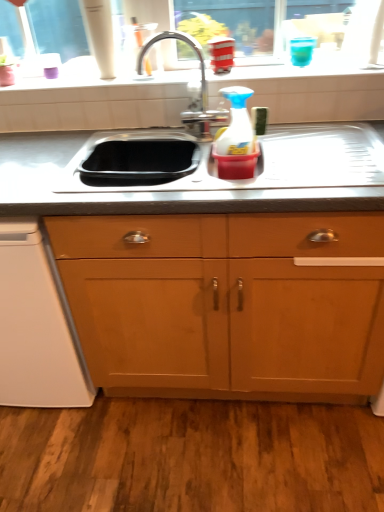
In order to face white glossy window sill at upper center, should I rotate leftwards or rightwards?

It's best to rotate left around 1.848 degrees.

What do you see at coordinates (37, 325) in the screenshot? I see `white plastic dishwasher at lower left` at bounding box center [37, 325].

Identify the location of white plastic dishwasher at lower left. The image size is (384, 512). (37, 325).

What do you see at coordinates (236, 124) in the screenshot? The image size is (384, 512). I see `translucent plastic spray bottle at center` at bounding box center [236, 124].

Measure the distance between point (x=217, y=142) and camera.

Point (x=217, y=142) and camera are 1.27 meters apart from each other.

This screenshot has height=512, width=384. Find the location of `stainless steel sink at center`. stainless steel sink at center is located at coordinates (146, 191).

This screenshot has height=512, width=384. I want to click on polished chrome faucet at center, so click(201, 88).

What is the approximate width of wooden cabinet at center?

24.22 inches.

The image size is (384, 512). Identify the location of white glossy window sill at upper center. (299, 78).

From a real-world perspective, who is located higher, stainless steel sink at center or white glossy window sill at upper center?

In real-world perspective, white glossy window sill at upper center is above.

Is point (272, 211) farther from viewer compared to point (361, 83)?

No, (272, 211) is in front of (361, 83).

Is stainless steel sink at center next to white glossy window sill at upper center and touching it?

No, stainless steel sink at center is not beside white glossy window sill at upper center.

Choose the correct answer: Is wooden cabinet at center inside stainless steel sink at center or outside it?

wooden cabinet at center exists outside the volume of stainless steel sink at center.

The height and width of the screenshot is (512, 384). Find the location of `countertop on the left of wooden cabinet at center`. countertop on the left of wooden cabinet at center is located at coordinates (146, 191).

Looking at this image, which of these two, wooden cabinet at center or stainless steel sink at center, is smaller?

stainless steel sink at center is smaller.

From a real-world perspective, is wooden cabinet at center positioned under stainless steel sink at center based on gravity?

Yes, from a real-world perspective, wooden cabinet at center is below stainless steel sink at center.

Is white glossy window sill at upper center at the back of white plastic dishwasher at lower left?

No, white plastic dishwasher at lower left is not facing away from white glossy window sill at upper center.

In the scene shown: Is white plastic dishwasher at lower left outside of white glossy window sill at upper center?

white plastic dishwasher at lower left lies outside white glossy window sill at upper center's area.

From a real-world perspective, which is physically below, white plastic dishwasher at lower left or white glossy window sill at upper center?

white plastic dishwasher at lower left.

Can you confirm if white plastic dishwasher at lower left is thinner than white glossy window sill at upper center?

In fact, white plastic dishwasher at lower left might be wider than white glossy window sill at upper center.

Are white glossy window sill at upper center and translucent plastic spray bottle at center beside each other?

No, white glossy window sill at upper center is not next to translucent plastic spray bottle at center.

Between point (302, 72) and point (229, 131), which one is positioned in front?

The point (229, 131) is in front.

From the image's perspective, which is above, white glossy window sill at upper center or translucent plastic spray bottle at center?

white glossy window sill at upper center, from the image's perspective.

Is white glossy window sill at upper center turned away from translucent plastic spray bottle at center?

No, white glossy window sill at upper center is not facing the opposite direction of translucent plastic spray bottle at center.

Looking at the image, does white plastic dishwasher at lower left seem bigger or smaller compared to stainless steel sink at center?

white plastic dishwasher at lower left is bigger than stainless steel sink at center.

From a real-world perspective, is white plastic dishwasher at lower left located beneath stainless steel sink at center?

Yes, from a real-world perspective, white plastic dishwasher at lower left is below stainless steel sink at center.

From the image's perspective, does white plastic dishwasher at lower left appear lower than stainless steel sink at center?

Correct, white plastic dishwasher at lower left appears lower than stainless steel sink at center in the image.

Between white plastic dishwasher at lower left and stainless steel sink at center, which one is positioned behind?

white plastic dishwasher at lower left is more distant.

Can you tell me how much polished chrome faucet at center and white plastic dishwasher at lower left differ in facing direction?

There is a 1.32-degree angle between the facing directions of polished chrome faucet at center and white plastic dishwasher at lower left.

Considering the sizes of objects polished chrome faucet at center and white plastic dishwasher at lower left in the image provided, who is thinner, polished chrome faucet at center or white plastic dishwasher at lower left?

polished chrome faucet at center.

Is polished chrome faucet at center located outside white plastic dishwasher at lower left?

Yes, polished chrome faucet at center is outside of white plastic dishwasher at lower left.

Is polished chrome faucet at center at the left side of white plastic dishwasher at lower left?

No.

From the picture: Between translucent plastic spray bottle at center and white glossy window sill at upper center, which one appears on the left side from the viewer's perspective?

white glossy window sill at upper center.

How distant is translucent plastic spray bottle at center from white glossy window sill at upper center?

12.12 inches.

Is translucent plastic spray bottle at center turned away from white glossy window sill at upper center?

Yes, translucent plastic spray bottle at center's orientation is away from white glossy window sill at upper center.

Is translucent plastic spray bottle at center wider than white glossy window sill at upper center?

In fact, translucent plastic spray bottle at center might be narrower than white glossy window sill at upper center.

In order to click on window sill that appears on the left of stainless steel sink at center in this screenshot , I will do `click(299, 78)`.

At what (x,y) coordinates should I click in order to perform the action: click on countertop behind the wooden cabinet at center. Please return your answer as a coordinate pair (x, y). Image resolution: width=384 pixels, height=512 pixels. Looking at the image, I should click on (146, 191).

Based on their spatial positions, is stainless steel sink at center or white plastic dishwasher at lower left closer to white glossy window sill at upper center?

Among the two, stainless steel sink at center is located nearer to white glossy window sill at upper center.

Which object lies nearer to the anchor point stainless steel sink at center, white plastic dishwasher at lower left or white glossy window sill at upper center?

white glossy window sill at upper center.

Estimate the real-world distances between objects in this image. Which object is further from polished chrome faucet at center, translucent plastic spray bottle at center or white plastic dishwasher at lower left?

white plastic dishwasher at lower left is further to polished chrome faucet at center.

When comparing their distances from polished chrome faucet at center, does wooden cabinet at center or stainless steel sink at center seem closer?

The object closer to polished chrome faucet at center is stainless steel sink at center.

Considering their positions, is translucent plastic spray bottle at center positioned further to white plastic dishwasher at lower left than polished chrome faucet at center?

polished chrome faucet at center is further to white plastic dishwasher at lower left.

From the image, which object appears to be farther from translucent plastic spray bottle at center, polished chrome faucet at center or stainless steel sink at center?

stainless steel sink at center is positioned further to the anchor translucent plastic spray bottle at center.

Which object lies nearer to the anchor point translucent plastic spray bottle at center, white plastic dishwasher at lower left or white glossy window sill at upper center?

white glossy window sill at upper center.

Looking at this image, looking at the image, which one is located closer to translucent plastic spray bottle at center, polished chrome faucet at center or white plastic dishwasher at lower left?

polished chrome faucet at center is closer to translucent plastic spray bottle at center.

Where is `appliance between white plastic dishwasher at lower left and wooden cabinet at center from left to right`? The width and height of the screenshot is (384, 512). appliance between white plastic dishwasher at lower left and wooden cabinet at center from left to right is located at coordinates (236, 124).

You are a GUI agent. You are given a task and a screenshot of the screen. Output one action in this format:
    pyautogui.click(x=<x>, y=<y>)
    Task: Click on the cabinetry between white glossy window sill at upper center and white plastic dishwasher at lower left vertically
    The width and height of the screenshot is (384, 512).
    Given the screenshot: What is the action you would take?
    pyautogui.click(x=228, y=303)

Find the location of `appliance between white glossy window sill at upper center and wooden cabinet at center in the vertical direction`. appliance between white glossy window sill at upper center and wooden cabinet at center in the vertical direction is located at coordinates (236, 124).

I want to click on countertop between white glossy window sill at upper center and wooden cabinet at center in the up-down direction, so click(x=146, y=191).